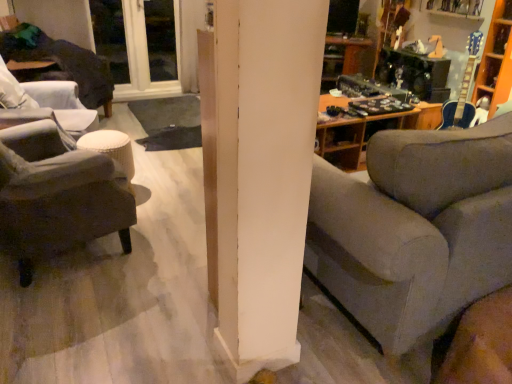
Question: Is point (57, 92) closer or farther from the camera than point (20, 193)?

Choices:
 (A) farther
 (B) closer

Answer: (A)

Question: Would you say dark fabric chair at left, which ranks as the second chair in bottom-to-top order, is to the left or to the right of dark gray fabric ottoman at left, the 2th chair positioned from the top, in the picture?

Choices:
 (A) left
 (B) right

Answer: (A)

Question: Estimate the real-world distances between objects in this image. Which object is farther from the burlap-textured stool at left?

Choices:
 (A) dark fabric chair at left, the 1th chair viewed from the top
 (B) gray fabric couch at center
 (C) dark gray fabric ottoman at left, the 2th chair viewed from the back
 (D) white plastic window at upper left

Answer: (D)

Question: Estimate the real-world distances between objects in this image. Which object is farther from the gray fabric couch at center?

Choices:
 (A) dark fabric chair at left, acting as the second chair starting from the front
 (B) burlap-textured stool at left
 (C) white plastic window at upper left
 (D) dark gray fabric ottoman at left, the 1th chair positioned from the bottom

Answer: (C)